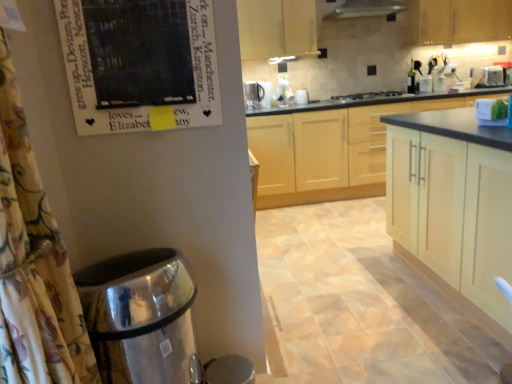
What do you see at coordinates (254, 94) in the screenshot?
I see `metallic silver mug at upper center` at bounding box center [254, 94].

The image size is (512, 384). Describe the element at coordinates (330, 150) in the screenshot. I see `light wood cabinets at center, placed as the third cabinetry when sorted from back to front` at that location.

The width and height of the screenshot is (512, 384). What do you see at coordinates (284, 92) in the screenshot?
I see `matte white faucet at upper center` at bounding box center [284, 92].

Where is `metallic silver mug at upper center`? This screenshot has height=384, width=512. metallic silver mug at upper center is located at coordinates (x=254, y=94).

Who is taller, light wood cabinet at center, the 1th cabinetry from the front, or matte white faucet at upper center?

light wood cabinet at center, the 1th cabinetry from the front, is taller.

From a real-world perspective, which object stands above the other?

matte white faucet at upper center.

How far apart are light wood cabinet at center, the 1th cabinetry from the front, and matte white faucet at upper center?

They are 2.04 meters apart.

Is light wood cabinet at center, the 1th cabinetry from the front, thinner than matte white faucet at upper center?

No.

How distant is light wood cabinets at center, which is the second cabinetry from front to back, from black glass stove at center?

They are 20.75 inches apart.

Is light wood cabinets at center, which is the second cabinetry from front to back, closer to the viewer compared to black glass stove at center?

Yes, it is in front of black glass stove at center.

This screenshot has width=512, height=384. In order to click on home appliance on the left of the light wood cabinets at center, which is the second cabinetry from front to back in this screenshot , I will do `click(368, 96)`.

From a real-world perspective, which is physically below, metallic silver mug at upper center or green glass bottle at upper right?

metallic silver mug at upper center is physically lower.

Choose the correct answer: Is metallic silver mug at upper center inside green glass bottle at upper right or outside it?

metallic silver mug at upper center is located beyond the bounds of green glass bottle at upper right.

Which is closer, (259,88) or (412,67)?

The point (259,88) is in front.

Is floral fabric shower curtain at left placed right next to white glossy exhaust hood at upper center?

No, floral fabric shower curtain at left is not touching white glossy exhaust hood at upper center.

How many degrees apart are the facing directions of floral fabric shower curtain at left and white glossy exhaust hood at upper center?

They differ by 89.9 degrees in their facing directions.

Consider the image. Which object is further away from the camera, floral fabric shower curtain at left or white glossy exhaust hood at upper center?

white glossy exhaust hood at upper center is further from the camera.

The image size is (512, 384). In order to click on shower curtain on the left side of white glossy exhaust hood at upper center in this screenshot , I will do `click(34, 264)`.

Considering the positions of objects floral fabric shower curtain at left and light wood cabinet at upper center, which appears as the 2th cabinetry when viewed from the back, in the image provided, who is more to the right, floral fabric shower curtain at left or light wood cabinet at upper center, which appears as the 2th cabinetry when viewed from the back,?

light wood cabinet at upper center, which appears as the 2th cabinetry when viewed from the back.

From a real-world perspective, is floral fabric shower curtain at left physically located above or below light wood cabinet at upper center, the 3th cabinetry viewed from the front?

floral fabric shower curtain at left is below light wood cabinet at upper center, the 3th cabinetry viewed from the front.

Who is more distant, floral fabric shower curtain at left or light wood cabinet at upper center, which appears as the 2th cabinetry when viewed from the back?

light wood cabinet at upper center, which appears as the 2th cabinetry when viewed from the back.

From the image's perspective, which one is positioned lower, black matte poster at upper left or light wood cabinet at upper center, the 3th cabinetry viewed from the front?

From the image's view, black matte poster at upper left is below.

From a real-world perspective, between black matte poster at upper left and light wood cabinet at upper center, the 3th cabinetry viewed from the front, who is vertically higher?

light wood cabinet at upper center, the 3th cabinetry viewed from the front, is physically above.

Who is bigger, black matte poster at upper left or light wood cabinet at upper center, which appears as the 2th cabinetry when viewed from the back?

→ Bigger between the two is light wood cabinet at upper center, which appears as the 2th cabinetry when viewed from the back.

Considering the positions of objects black matte poster at upper left and light wood cabinet at upper center, the 3th cabinetry viewed from the front, in the image provided, who is more to the right, black matte poster at upper left or light wood cabinet at upper center, the 3th cabinetry viewed from the front,?

Positioned to the right is light wood cabinet at upper center, the 3th cabinetry viewed from the front.

Which is more to the right, green glass bottle at upper right or black matte poster at upper left?

From the viewer's perspective, green glass bottle at upper right appears more on the right side.

From the image's perspective, would you say green glass bottle at upper right is positioned over black matte poster at upper left?

Correct, green glass bottle at upper right appears higher than black matte poster at upper left in the image.

Could you tell me if green glass bottle at upper right is facing black matte poster at upper left?

No.

Relative to black matte poster at upper left, is green glass bottle at upper right in front or behind?

In the image, green glass bottle at upper right appears behind black matte poster at upper left.

Where is `the 4th cabinetry in front of the matte white faucet at upper center`? the 4th cabinetry in front of the matte white faucet at upper center is located at coordinates (453, 200).

From a real-world perspective, starting from the black glass stove at center, which cabinetry is the 2nd one below it? Please provide its 2D coordinates.

[(330, 150)]

Estimate the real-world distances between objects in this image. Which object is closer to matte white faucet at upper center, floral fabric shower curtain at left or metallic silver mug at upper center?

metallic silver mug at upper center is positioned closer to the anchor matte white faucet at upper center.

Looking at the image, which one is located closer to metallic silver mug at upper center, floral fabric shower curtain at left or polished stainless steel water heater at lower left?

Among the two, polished stainless steel water heater at lower left is located nearer to metallic silver mug at upper center.

From the image, which object appears to be farther from black glass stove at center, light wood cabinet at upper right, acting as the fourth cabinetry starting from the front, or metallic silver mug at upper center?

light wood cabinet at upper right, acting as the fourth cabinetry starting from the front, is further to black glass stove at center.

When comparing their distances from metallic silver mug at upper center, does green glass bottle at upper right or light wood cabinets at center, placed as the third cabinetry when sorted from back to front, seem further?

Among the two, green glass bottle at upper right is located further to metallic silver mug at upper center.

Estimate the real-world distances between objects in this image. Which object is further from white glossy exhaust hood at upper center, matte white faucet at upper center or floral fabric shower curtain at left?

floral fabric shower curtain at left is positioned further to the anchor white glossy exhaust hood at upper center.

When comparing their distances from metallic silver mug at upper center, does polished stainless steel water heater at lower left or white glossy exhaust hood at upper center seem further?

polished stainless steel water heater at lower left lies further to metallic silver mug at upper center than the other object.

Estimate the real-world distances between objects in this image. Which object is further from black glass stove at center, polished stainless steel water heater at lower left or light wood cabinet at upper center, which appears as the 2th cabinetry when viewed from the back?

polished stainless steel water heater at lower left.

Looking at this image, from the image, which object appears to be nearer to matte white faucet at upper center, green glass bottle at upper right or light wood cabinets at center, placed as the third cabinetry when sorted from back to front?

Based on the image, light wood cabinets at center, placed as the third cabinetry when sorted from back to front, appears to be nearer to matte white faucet at upper center.

This screenshot has width=512, height=384. I want to click on exhaust hood between light wood cabinet at center, acting as the fourth cabinetry starting from the back, and light wood cabinet at upper right, acting as the fourth cabinetry starting from the front, along the z-axis, so click(x=369, y=9).

At what (x,y) coordinates should I click in order to perform the action: click on bulletin board between floral fabric shower curtain at left and light wood cabinet at upper right, acting as the fourth cabinetry starting from the front, from front to back. Please return your answer as a coordinate pair (x, y). This screenshot has width=512, height=384. Looking at the image, I should click on (139, 63).

Locate an element on the screen. cabinetry between metallic silver mug at upper center and black glass stove at center is located at coordinates (277, 28).

Identify the location of bulletin board between floral fabric shower curtain at left and white glossy exhaust hood at upper center in the front-back direction. (139, 63).